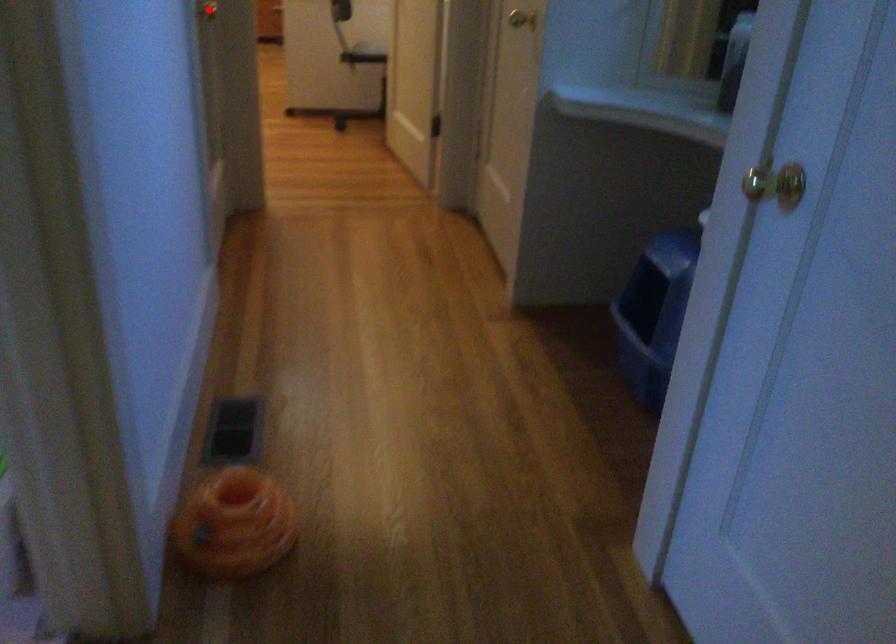
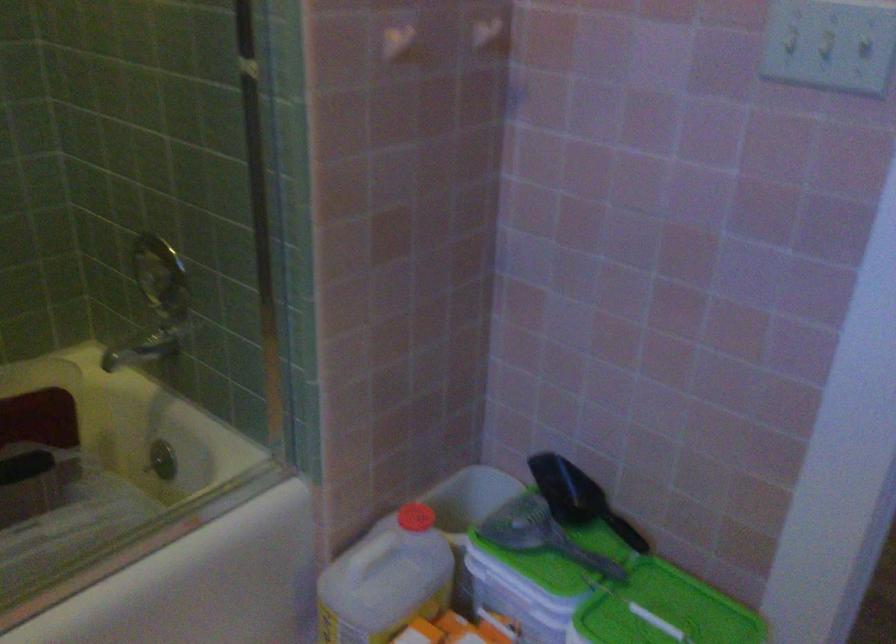
Question: I am providing you with two images of the same scene from different viewpoints. A red point is marked on the first image. Can you still see the location of the red point in image 2?

Choices:
 (A) Yes
 (B) No

Answer: (B)